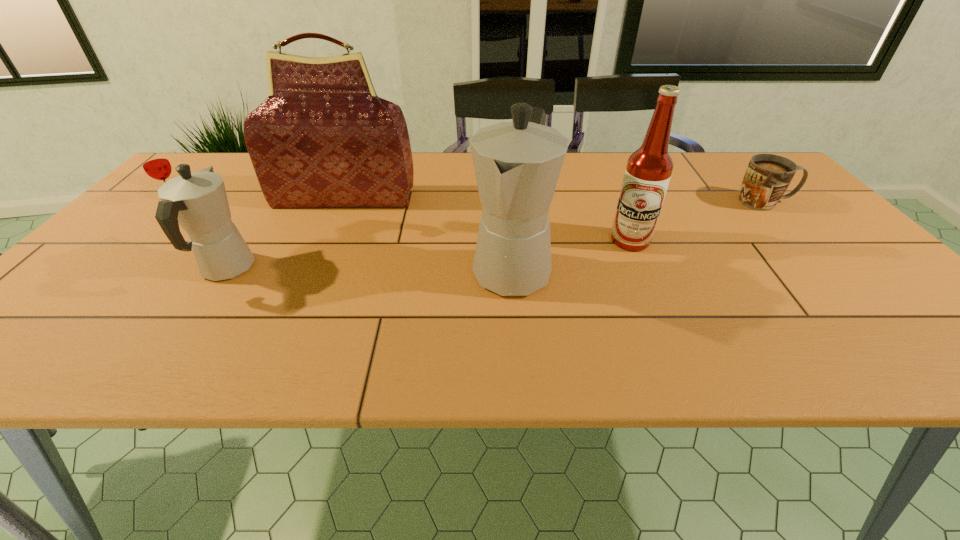
Identify the location of the shorter coffeepot. (197, 201).

Where is `the left coffeepot`? This screenshot has height=540, width=960. the left coffeepot is located at coordinates point(197,201).

Identify the location of the fourth object from left to right. The width and height of the screenshot is (960, 540). (517, 164).

At what (x,y) coordinates should I click in order to perform the action: click on the right coffeepot. Please return your answer as a coordinate pair (x, y). Looking at the image, I should click on (517, 164).

Locate an element on the screen. This screenshot has width=960, height=540. glass is located at coordinates (155, 163).

At what (x,y) coordinates should I click in order to perform the action: click on the leftmost object. Please return your answer as a coordinate pair (x, y). The width and height of the screenshot is (960, 540). Looking at the image, I should click on (155, 163).

The width and height of the screenshot is (960, 540). Find the location of `the second object from right to left`. the second object from right to left is located at coordinates (648, 171).

At what (x,y) coordinates should I click in order to perform the action: click on handbag. Please return your answer as a coordinate pair (x, y). This screenshot has width=960, height=540. Looking at the image, I should click on (323, 138).

Where is `the shortest object`? The image size is (960, 540). the shortest object is located at coordinates 767,177.

At what (x,y) coordinates should I click in order to perform the action: click on the rightmost object. Please return your answer as a coordinate pair (x, y). This screenshot has width=960, height=540. Looking at the image, I should click on (767, 177).